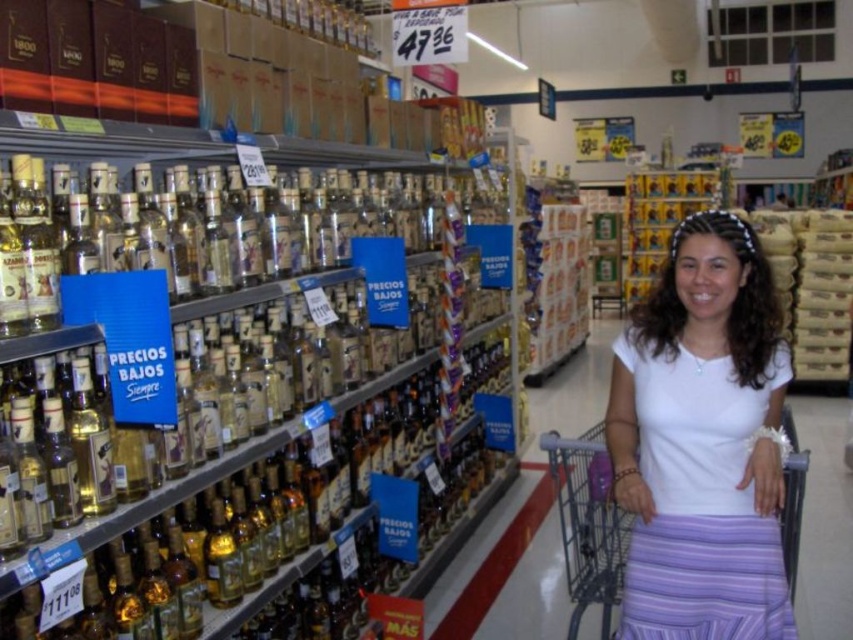
The width and height of the screenshot is (853, 640). Describe the element at coordinates (701, 442) in the screenshot. I see `white matte shirt at center` at that location.

Is white matte shirt at center above metallic gray shopping cart at lower right?

Correct, white matte shirt at center is located above metallic gray shopping cart at lower right.

This screenshot has height=640, width=853. I want to click on white matte shirt at center, so click(x=701, y=442).

Where is `white matte shirt at center`? This screenshot has width=853, height=640. white matte shirt at center is located at coordinates (701, 442).